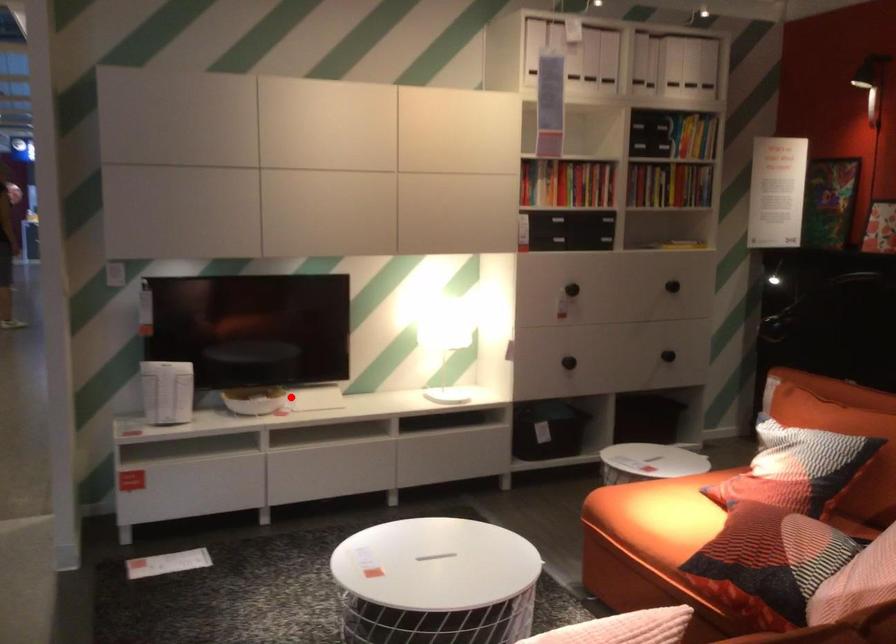
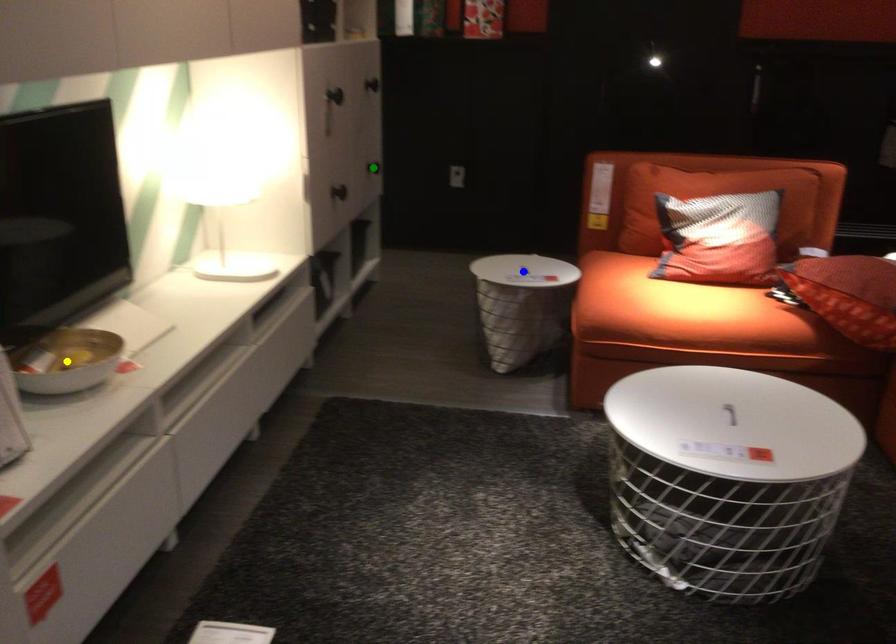
Question: I am providing you with two images of the same scene from different viewpoints. A red point is marked on the first image. You are given multiple points on the second image. Can you choose the point in image 2 that corresponds to the point in image 1?

Choices:
 (A) yellow point
 (B) blue point
 (C) green point

Answer: (A)